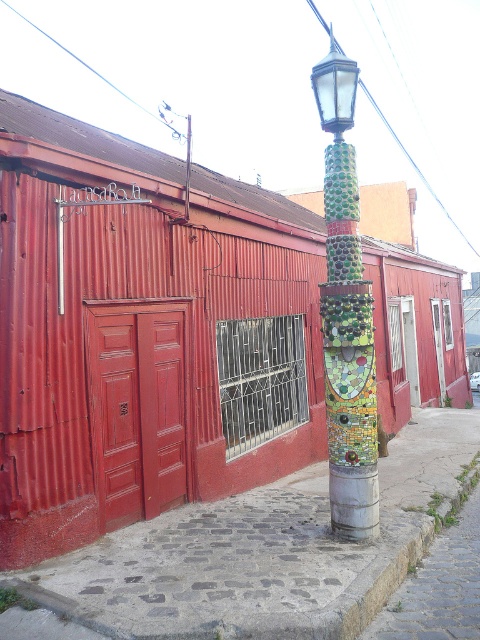
Question: Which point appears farthest from the camera in this image?

Choices:
 (A) (350, 246)
 (B) (167, 604)

Answer: (A)

Question: Is cobblestone pavement at center wider than green mosaic lamp post at center?

Choices:
 (A) no
 (B) yes

Answer: (A)

Question: Which of the following is the closest to the observer?

Choices:
 (A) (346, 157)
 (B) (128, 582)

Answer: (B)

Question: Where is cobblestone pavement at center located in relation to green mosaic lamp post at center in the image?

Choices:
 (A) above
 (B) below

Answer: (B)

Question: Observing the image, what is the correct spatial positioning of cobblestone pavement at center in reference to green mosaic lamp post at center?

Choices:
 (A) left
 (B) right

Answer: (A)

Question: Which of the following is the farthest from the observer?

Choices:
 (A) (355, 273)
 (B) (117, 586)

Answer: (A)